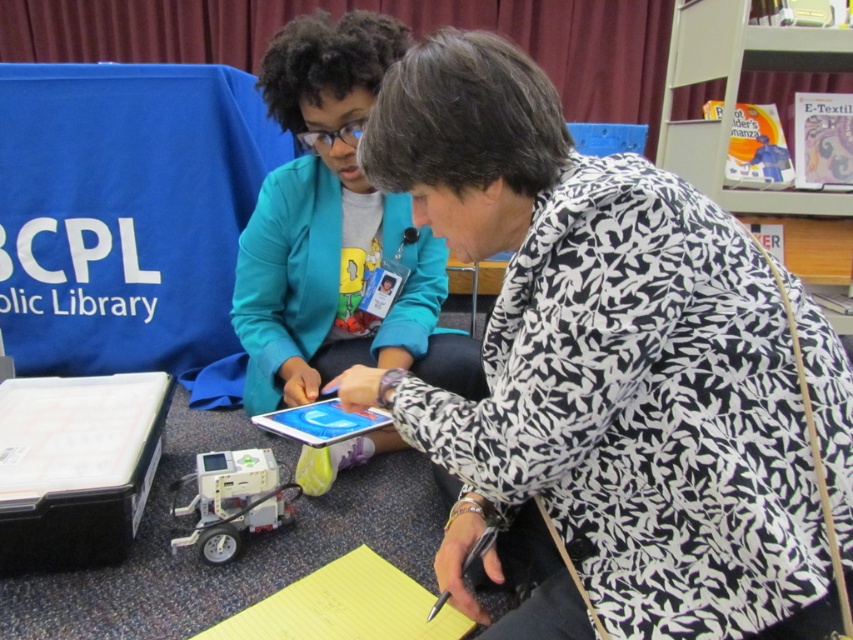
You are a photographer at the BCPL Public Library event. You need to take a photo of both the black printed shirt at center and the teal fabric jacket at center. Based on their positions, which one should you focus on first to ensure both are in frame?

The black printed shirt at center is to the right of the teal fabric jacket at center, so you should focus on the teal fabric jacket at center first to ensure both are in frame.

You are standing in front of the two individuals at the library event. Which object, the black printed shirt at center or the teal fabric jacket at center, is nearer to you?

The black printed shirt at center is closer to the viewer than the teal fabric jacket at center.

From the picture: You are a photographer setting up for a group photo at the library event. You need to ensure that the black printed shirt at center and the metallic plastic robot at lower left are both visible in the frame. Based on their heights, which object should you position closer to the camera to maintain visibility?

The metallic plastic robot at lower left is shorter than the black printed shirt at center, so positioning it closer to the camera will help ensure both are visible in the frame.